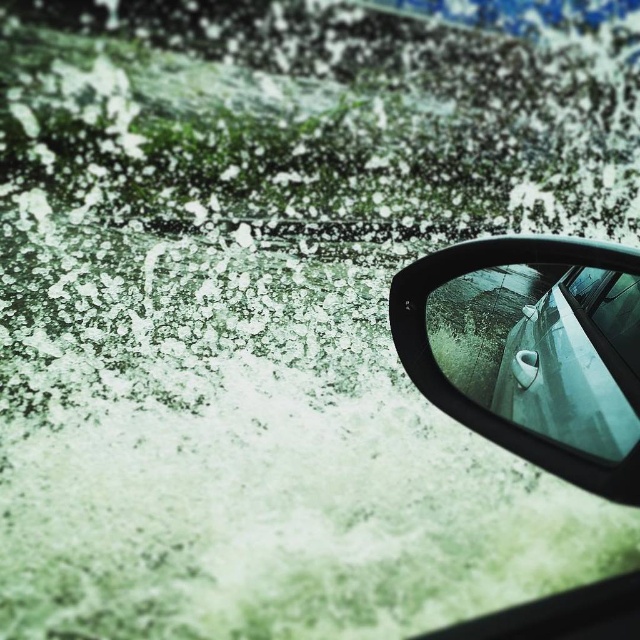
Is black glossy car mirror at upper right positioned behind clear glass car window at center?

No, it is in front of clear glass car window at center.

Between black glossy car mirror at upper right and clear glass car window at center, which one has less height?

Standing shorter between the two is clear glass car window at center.

Is point (582, 326) positioned in front of point (630, 330)?

That is False.

You are a GUI agent. You are given a task and a screenshot of the screen. Output one action in this format:
    pyautogui.click(x=<x>, y=<y>)
    Task: Click on the black glossy car mirror at upper right
    The height and width of the screenshot is (640, 640).
    Given the screenshot: What is the action you would take?
    pyautogui.click(x=531, y=349)